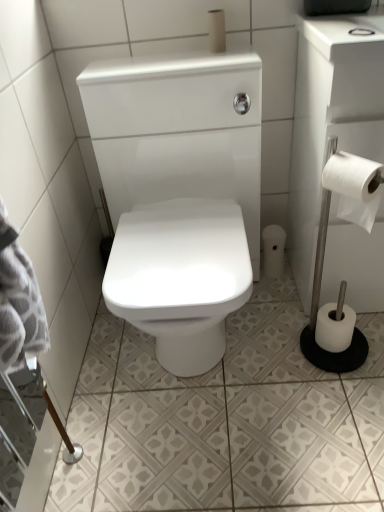
The height and width of the screenshot is (512, 384). I want to click on free space in front of white glossy toilet at center, so click(218, 454).